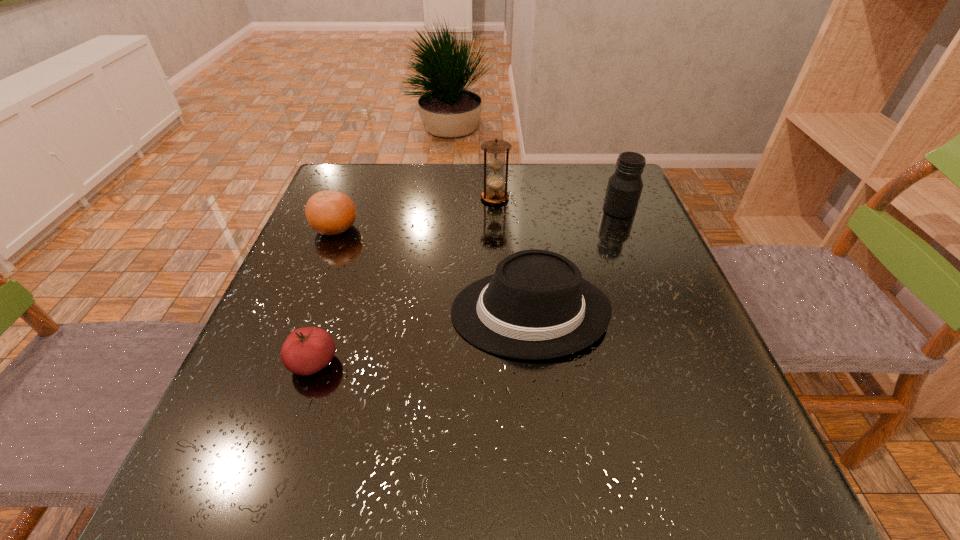
In the image, there is a desktop. Where is `free space at the left edge`? The image size is (960, 540). free space at the left edge is located at coordinates click(328, 292).

Locate an element on the screen. free space at the right edge is located at coordinates (660, 295).

This screenshot has height=540, width=960. Identify the location of free space at the near left corner. (276, 461).

At what (x,y) coordinates should I click in order to perform the action: click on blank space at the far right corner of the desktop. Please return your answer as a coordinate pair (x, y). Looking at the image, I should click on (595, 164).

Identify the location of free point between the third tallest object and the rightmost object. The height and width of the screenshot is (540, 960). (574, 261).

Locate an element on the screen. The height and width of the screenshot is (540, 960). free space between the third tallest object and the clementine is located at coordinates (432, 271).

I want to click on free spot between the clementine and the hourglass, so click(x=415, y=213).

At what (x,y) coordinates should I click in order to perform the action: click on empty space between the third tallest object and the clementine. Please return your answer as a coordinate pair (x, y). This screenshot has width=960, height=540. Looking at the image, I should click on pos(432,271).

This screenshot has height=540, width=960. Identify the location of vacant point located between the rightmost object and the tomato. (467, 286).

Where is `vacant area that lies between the tomato and the rightmost object`? The width and height of the screenshot is (960, 540). vacant area that lies between the tomato and the rightmost object is located at coordinates (467, 286).